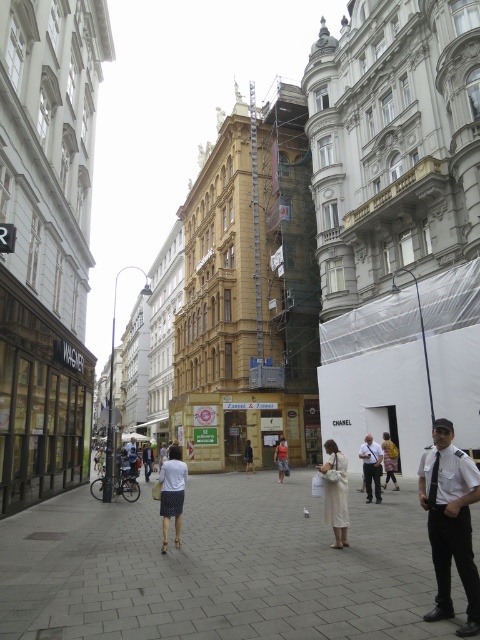
Question: Which point is farther to the camera?

Choices:
 (A) denim skirt at center
 (B) light beige fabric bag at center

Answer: (A)

Question: Which point is closer to the camera?

Choices:
 (A) (175, 509)
 (B) (433, 438)
 (C) (249, 464)
 (D) (387, 438)

Answer: (B)

Question: Is gray brick pavement at center smaller than white cotton shirt at center?

Choices:
 (A) no
 (B) yes

Answer: (A)

Question: Which point is closer to the camera taking this photo?

Choices:
 (A) (326, 440)
 (B) (232, 484)
 (C) (397, 484)

Answer: (C)

Question: Is white uniform at right in front of dark gray uniform at center?

Choices:
 (A) yes
 (B) no

Answer: (A)

Question: Is dark gray uniform at center thinner than light beige fabric bag at center?

Choices:
 (A) yes
 (B) no

Answer: (B)